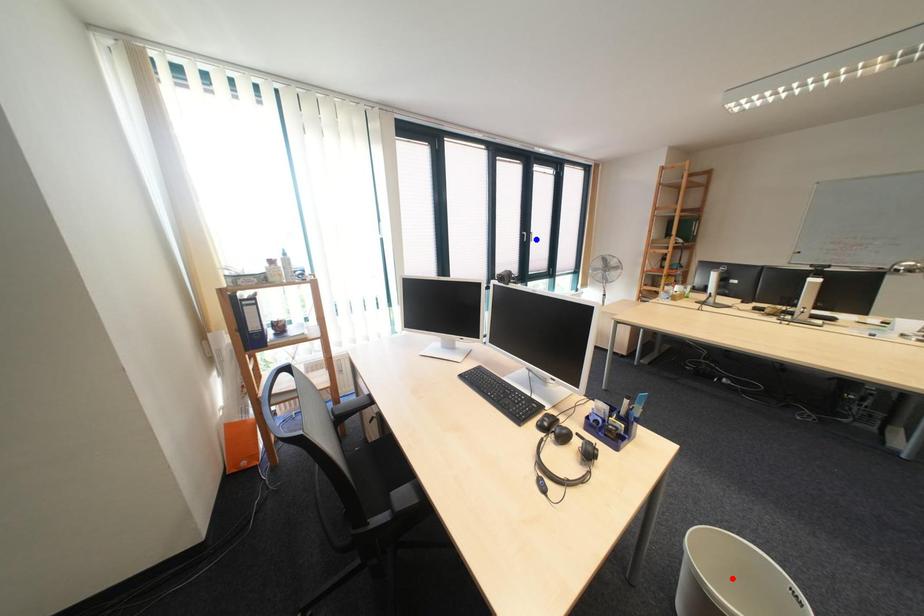
Question: Two points are marked on the image. Which point is closer to the camera?

Choices:
 (A) Blue point is closer.
 (B) Red point is closer.

Answer: (B)